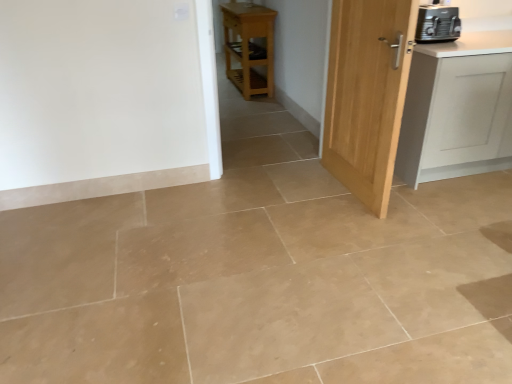
Question: Is black plastic toaster at upper right taller or shorter than white matte cabinet at right?

Choices:
 (A) short
 (B) tall

Answer: (A)

Question: Based on their positions, is black plastic toaster at upper right located to the left or right of white matte cabinet at right?

Choices:
 (A) right
 (B) left

Answer: (B)

Question: Which of these objects is positioned farthest from the light wood door at center right?

Choices:
 (A) black plastic toaster at upper right
 (B) white matte cabinet at right
 (C) light wood/matte table at center

Answer: (C)

Question: Considering the real-world distances, which object is farthest from the white matte cabinet at right?

Choices:
 (A) light wood/matte table at center
 (B) light wood door at center right
 (C) black plastic toaster at upper right

Answer: (A)